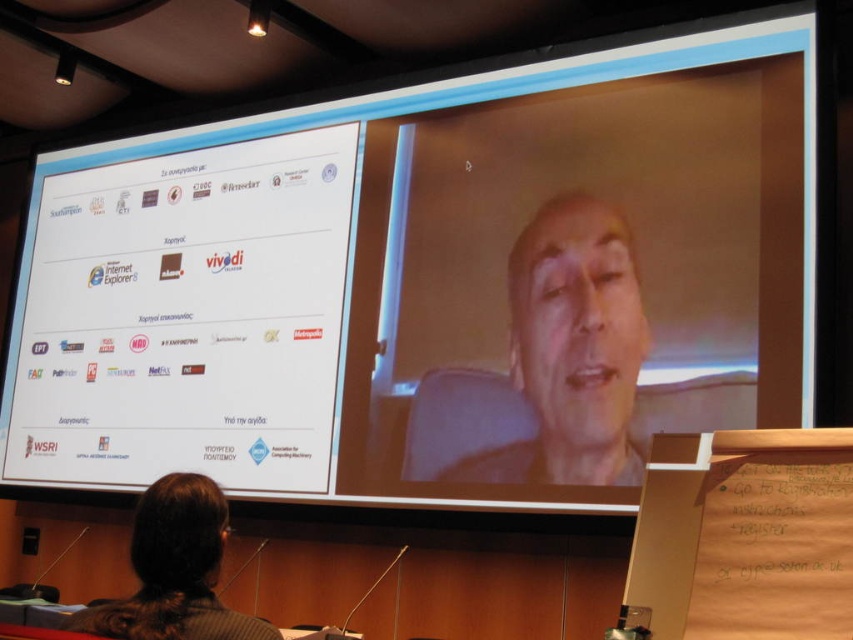
Question: Where is smooth skin face at center located in relation to brown hair at lower left in the image?

Choices:
 (A) below
 (B) above

Answer: (B)

Question: Which of the following is the farthest from the observer?

Choices:
 (A) brown hair at lower left
 (B) smooth skin face at center

Answer: (B)

Question: Is smooth skin face at center wider than brown hair at lower left?

Choices:
 (A) no
 (B) yes

Answer: (B)

Question: Can you confirm if smooth skin face at center is wider than brown hair at lower left?

Choices:
 (A) no
 (B) yes

Answer: (B)